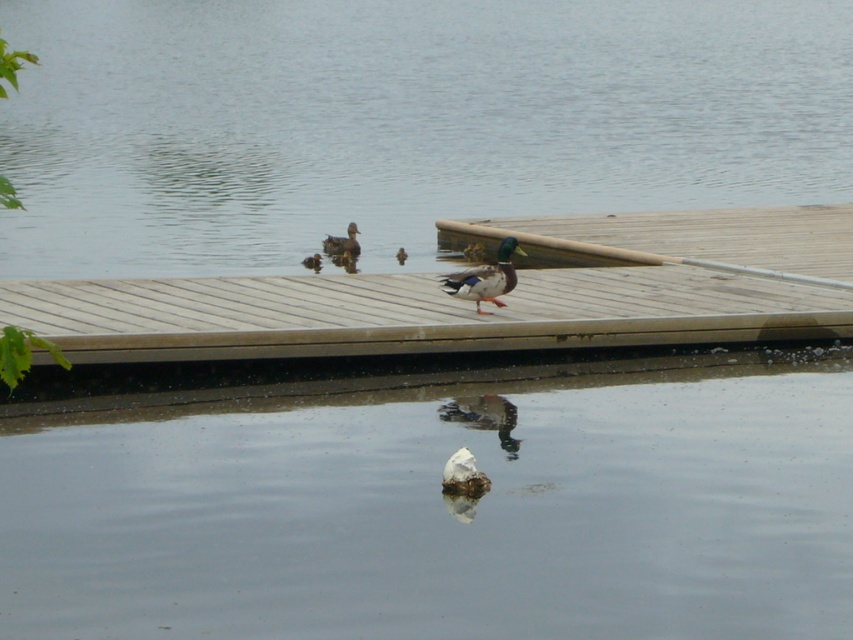
Between transparent water at dock center and wooden dock at center, which one appears on the right side from the viewer's perspective?

Positioned to the right is wooden dock at center.

Is transparent water at dock center above wooden dock at center?

Yes, transparent water at dock center is above wooden dock at center.

Does point (114, 13) lie behind point (112, 285)?

Yes, point (114, 13) is behind point (112, 285).

At what (x,y) coordinates should I click in order to perform the action: click on transparent water at dock center. Please return your answer as a coordinate pair (x, y). The width and height of the screenshot is (853, 640). Looking at the image, I should click on (399, 122).

Between wooden dock at center and shiny green duck at center, which one has more height?

Standing taller between the two is wooden dock at center.

Is wooden dock at center to the right of shiny green duck at center from the viewer's perspective?

In fact, wooden dock at center is to the left of shiny green duck at center.

Does point (225, 328) come farther from viewer compared to point (498, 307)?

No, (225, 328) is closer to viewer.

Identify the location of wooden dock at center. (415, 314).

Can you confirm if transparent water at dock center is thinner than brown fuzzy duckling at upper center?

In fact, transparent water at dock center might be wider than brown fuzzy duckling at upper center.

Is point (347, 92) less distant than point (335, 237)?

No, it is not.

What are the coordinates of `transparent water at dock center` in the screenshot? It's located at (399, 122).